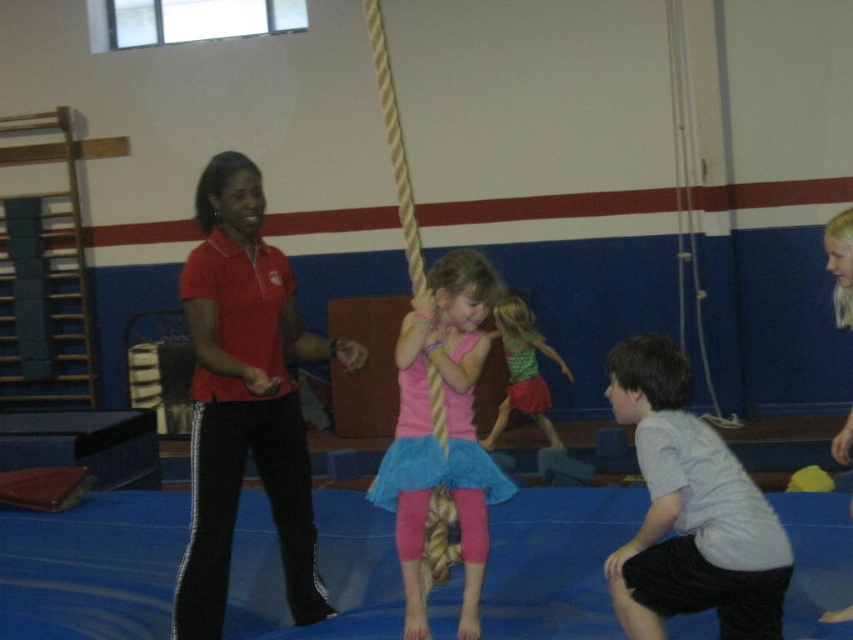
Question: Which of the following is the farthest from the observer?

Choices:
 (A) 415,634
 (B) 659,422

Answer: (A)

Question: Does gray cotton shirt at lower right have a greater width compared to pink satin skirt at center?

Choices:
 (A) no
 (B) yes

Answer: (A)

Question: Is gray cotton shirt at lower right positioned in front of pink satin skirt at center?

Choices:
 (A) yes
 (B) no

Answer: (A)

Question: Which point is farther to the camera?

Choices:
 (A) green textured dress at center
 (B) pink satin skirt at center

Answer: (A)

Question: Which is nearer to the pink satin skirt at center?

Choices:
 (A) green textured dress at center
 (B) gray cotton shirt at lower right

Answer: (B)

Question: Observing the image, what is the correct spatial positioning of pink satin skirt at center in reference to green textured dress at center?

Choices:
 (A) right
 (B) left

Answer: (B)